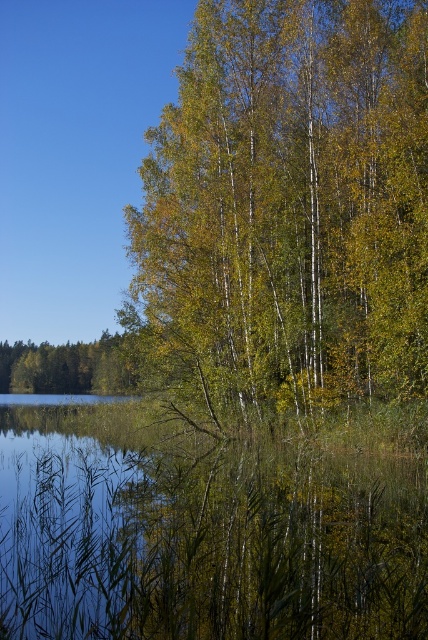
You are a photographer planning to capture the reflection of the green matte tree at center in the transparent water at lower left. Based on the scene, can you determine if the reflection will be narrower than the water itself?

The green matte tree at center has a lesser width compared to transparent water at lower left, so the reflection of the green matte tree at center will indeed be narrower than the transparent water at lower left.

You are standing at the point with coordinates point [311,353] and want to walk towards the point with coordinates point [118,387]. Based on the scene description, will you be moving towards the background or the foreground?

Since point [311,353] is in front of point [118,387], moving from point [311,353] towards point [118,387] would mean moving towards the background.

You are standing at the center of the image and want to reach the transparent water at lower left. Which direction should you move in to get there?

The transparent water at lower left is located at point (x=70, y=525), so you should move towards the lower left direction to reach it.